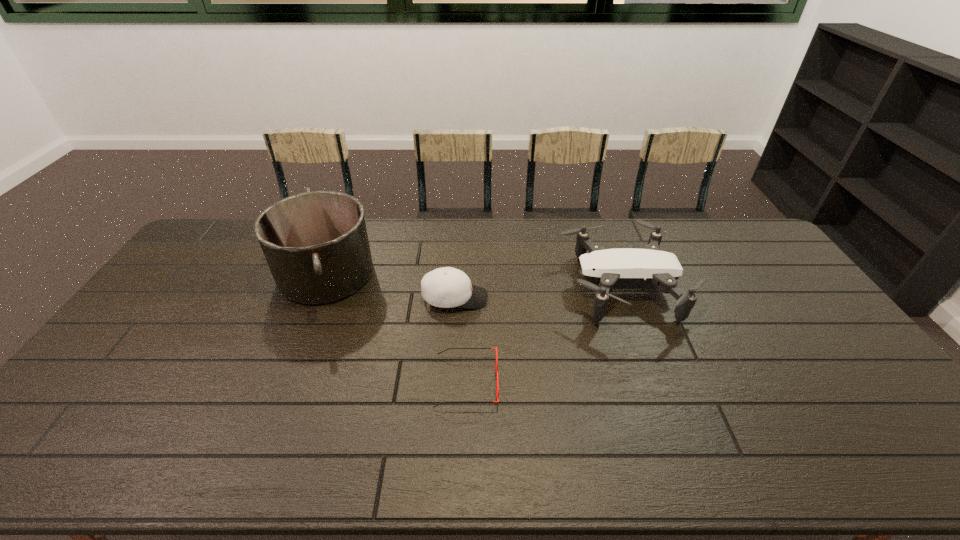
Find the location of a particular element. The image size is (960, 540). free spot between the shortest object and the third tallest object is located at coordinates (461, 340).

Locate an element on the screen. The height and width of the screenshot is (540, 960). free space between the pan and the spectacles is located at coordinates pos(396,328).

This screenshot has width=960, height=540. In order to click on free spot between the tallest object and the shortest object in this screenshot , I will do `click(396, 328)`.

At what (x,y) coordinates should I click in order to perform the action: click on free point between the second shortest object and the pan. Please return your answer as a coordinate pair (x, y). Looking at the image, I should click on (391, 286).

At what (x,y) coordinates should I click in order to perform the action: click on vacant region between the baseball cap and the spectacles. Please return your answer as a coordinate pair (x, y). This screenshot has height=540, width=960. Looking at the image, I should click on coord(461,340).

You are a GUI agent. You are given a task and a screenshot of the screen. Output one action in this format:
    pyautogui.click(x=<x>, y=<y>)
    Task: Click on the vacant space that is in between the tallest object and the baseball cap
    The width and height of the screenshot is (960, 540).
    Given the screenshot: What is the action you would take?
    pyautogui.click(x=391, y=286)

Find the location of a particular element. vacant area that lies between the leftmost object and the nearest object is located at coordinates (396, 328).

This screenshot has height=540, width=960. Identify the location of free spot between the rightmost object and the baseball cap. (539, 293).

Image resolution: width=960 pixels, height=540 pixels. In order to click on vacant area that lies between the baseball cap and the nearest object in this screenshot , I will do `click(461, 340)`.

Identify which object is the second closest to the shortest object. Please provide its 2D coordinates. Your answer should be formatted as a tuple, i.e. [(x, y)], where the tuple contains the x and y coordinates of a point satisfying the conditions above.

[(604, 269)]